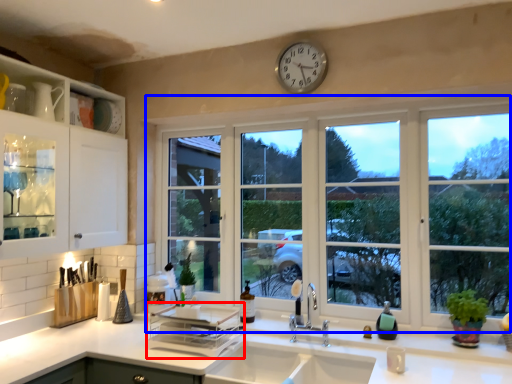
Question: Which of the following is the farthest to the observer, appliance (highlighted by a red box) or window (highlighted by a blue box)?

Choices:
 (A) appliance
 (B) window

Answer: (B)